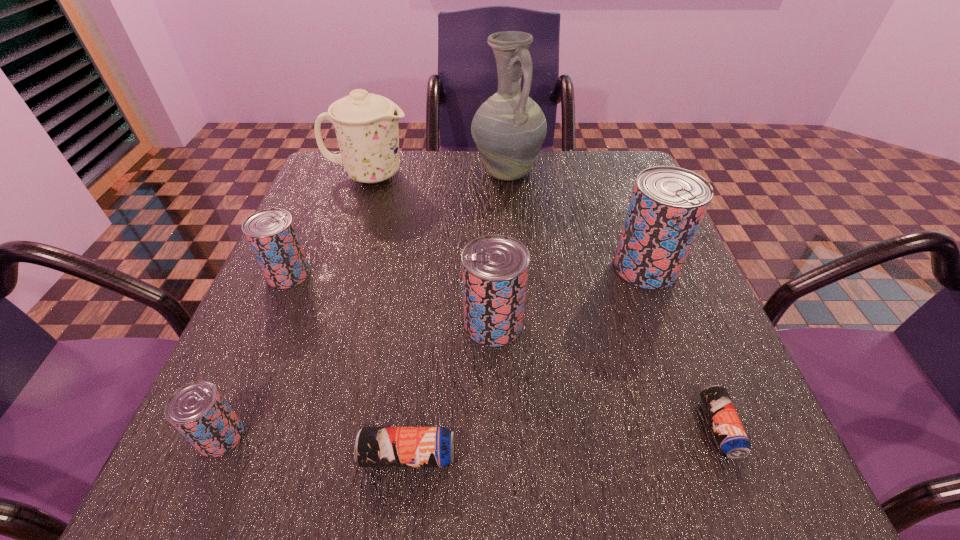
Select which red beer can appears as the second closest to the second smallest red beer can. Please provide its 2D coordinates. Your answer should be formatted as a tuple, i.e. [(x, y)], where the tuple contains the x and y coordinates of a point satisfying the conditions above.

[(495, 268)]

The height and width of the screenshot is (540, 960). I want to click on vacant point that satisfies the following two spatial constraints: 1. on the spout of the chinaware; 2. on the left side of the fifth shortest object, so click(x=321, y=323).

This screenshot has width=960, height=540. I want to click on free spot that satisfies the following two spatial constraints: 1. on the spout of the tallest beer can; 2. on the right side of the chinaware, so click(x=339, y=268).

At what (x,y) coordinates should I click in order to perform the action: click on free space that satisfies the following two spatial constraints: 1. on the front side of the fourth beer can from left to right; 2. on the left side of the shortest object. Please return your answer as a coordinate pair (x, y). The image size is (960, 540). Looking at the image, I should click on (496, 427).

Locate an element on the screen. free location that satisfies the following two spatial constraints: 1. on the spout of the chinaware; 2. on the back side of the biggest red beer can is located at coordinates (339, 268).

What are the coordinates of `free spot that satisfies the following two spatial constraints: 1. on the handle side of the tallest beer can; 2. on the right side of the tallest object` in the screenshot? It's located at (515, 268).

Where is `vacant area that satisfies the following two spatial constraints: 1. on the spout of the fourth tallest object; 2. on the left side of the chinaware`? Image resolution: width=960 pixels, height=540 pixels. vacant area that satisfies the following two spatial constraints: 1. on the spout of the fourth tallest object; 2. on the left side of the chinaware is located at coordinates (321, 323).